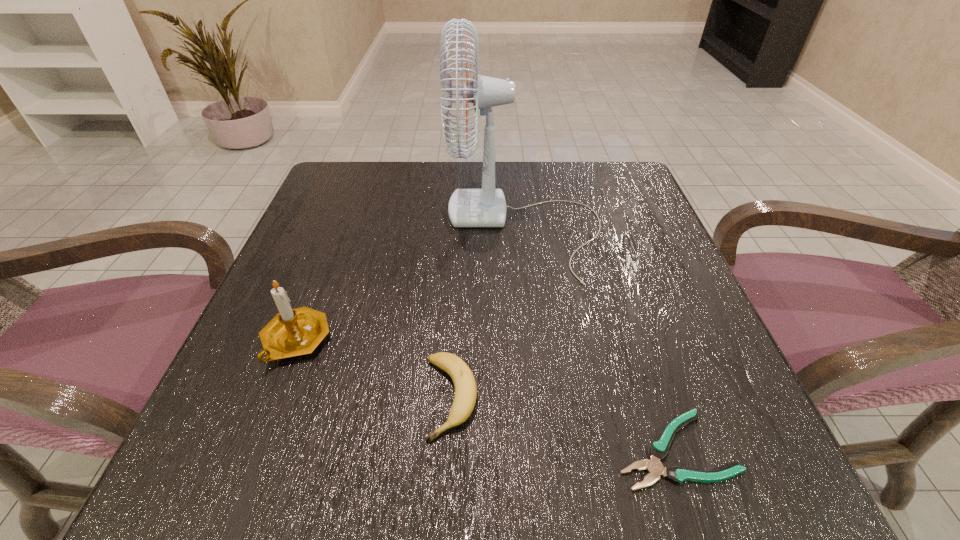
The width and height of the screenshot is (960, 540). In order to click on free location located 0.170m on the right of the banana in this screenshot , I will do `click(598, 397)`.

The image size is (960, 540). What are the coordinates of `vacant space located 0.070m on the back of the shortest object` in the screenshot? It's located at (647, 369).

Locate an element on the screen. This screenshot has width=960, height=540. object located in the far edge section of the desktop is located at coordinates (468, 208).

The height and width of the screenshot is (540, 960). Find the location of `banana that is at the near edge`. banana that is at the near edge is located at coordinates (465, 396).

Locate an element on the screen. The image size is (960, 540). pliers positioned at the near edge is located at coordinates (658, 450).

Where is `object that is positioned at the left edge`? object that is positioned at the left edge is located at coordinates (292, 332).

This screenshot has width=960, height=540. In order to click on fan situated at the right edge in this screenshot , I will do `click(468, 208)`.

Find the location of a particular element. This screenshot has width=960, height=540. pliers that is at the right edge is located at coordinates (658, 450).

You are a GUI agent. You are given a task and a screenshot of the screen. Output one action in this format:
    pyautogui.click(x=<x>, y=<y>)
    Task: Click on the object that is at the far right corner
    This screenshot has width=960, height=540.
    Given the screenshot: What is the action you would take?
    pyautogui.click(x=468, y=208)

This screenshot has height=540, width=960. I want to click on object present at the near right corner, so pyautogui.click(x=658, y=450).